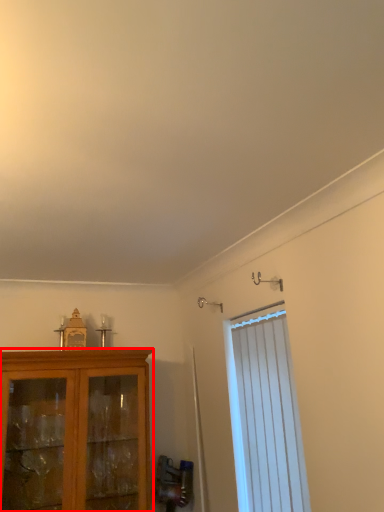
Question: Considering the relative positions of cabinetry (annotated by the red box) and window in the image provided, where is cabinetry (annotated by the red box) located with respect to the staircase?

Choices:
 (A) left
 (B) right

Answer: (A)